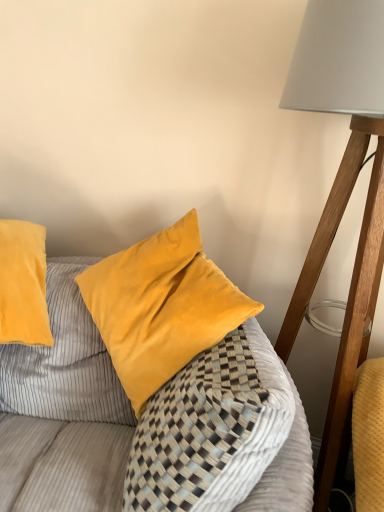
Describe the element at coordinates (135, 379) in the screenshot. I see `velvet yellow pillow at center` at that location.

In order to face velvet yellow pillow at center, should I rotate leftwards or rightwards?

You should look right and rotate roughly 1.075 degrees.

Measure the distance between point (303, 435) and camera.

Point (303, 435) is 37.20 inches away from camera.

At what (x,y) coordinates should I click in order to perform the action: click on velvet yellow pillow at center. Please return your answer as a coordinate pair (x, y). Looking at the image, I should click on [135, 379].

What is the approximate height of velvet yellow pillow at center?

velvet yellow pillow at center is 74.93 centimeters in height.

Where is `matte white lampshade at right`? This screenshot has height=512, width=384. matte white lampshade at right is located at coordinates (341, 193).

In order to face matte white lampshade at right, should I rotate leftwards or rightwards?

Rotate right and turn 19.046 degrees.

The image size is (384, 512). What do you see at coordinates (341, 193) in the screenshot?
I see `matte white lampshade at right` at bounding box center [341, 193].

Find the location of a particular element. velvet yellow pillow at center is located at coordinates (135, 379).

Between matte white lampshade at right and velvet yellow pillow at center, which one appears on the left side from the viewer's perspective?

velvet yellow pillow at center.

Is matte white lampshade at right positioned behind velvet yellow pillow at center?

Yes, matte white lampshade at right is further from the viewer.

Is point (343, 397) closer or farther from the camera than point (132, 282)?

Clearly, point (343, 397) is closer to the camera than point (132, 282).

From the image's perspective, between matte white lampshade at right and velvet yellow pillow at center, who is located below?

velvet yellow pillow at center appears lower in the image.

From a real-world perspective, is matte white lampshade at right physically located above or below velvet yellow pillow at center?

From a real-world perspective, matte white lampshade at right is physically above velvet yellow pillow at center.

Which of these two, matte white lampshade at right or velvet yellow pillow at center, is thinner?

velvet yellow pillow at center is thinner.

Between matte white lampshade at right and velvet yellow pillow at center, which one has more height?

With more height is matte white lampshade at right.

Which of these two, matte white lampshade at right or velvet yellow pillow at center, is smaller?

velvet yellow pillow at center is smaller.

Is matte white lampshade at right not inside velvet yellow pillow at center?

matte white lampshade at right lies outside velvet yellow pillow at center's area.

Is matte white lampshade at right placed right next to velvet yellow pillow at center?

There is a gap between matte white lampshade at right and velvet yellow pillow at center.

Is matte white lampshade at right positioned with its back to velvet yellow pillow at center?

No, velvet yellow pillow at center is not at the back of matte white lampshade at right.

What's the angular difference between matte white lampshade at right and velvet yellow pillow at center's facing directions?

The facing directions of matte white lampshade at right and velvet yellow pillow at center are 80.2 degrees apart.

Measure the distance from matte white lampshade at right to velvet yellow pillow at center.

matte white lampshade at right and velvet yellow pillow at center are 18.65 inches apart from each other.

Identify the location of furniture located in front of the matte white lampshade at right. This screenshot has height=512, width=384. (135, 379).

Considering the relative positions of velvet yellow pillow at center and matte white lampshade at right in the image provided, is velvet yellow pillow at center to the left of matte white lampshade at right from the viewer's perspective?

Yes.

Is velvet yellow pillow at center in front of matte white lampshade at right?

Yes, velvet yellow pillow at center is in front of matte white lampshade at right.

Is point (268, 437) in front of point (311, 13)?

Yes, point (268, 437) is closer to viewer.

From the image's perspective, relative to matte white lampshade at right, is velvet yellow pillow at center above or below?

velvet yellow pillow at center is situated lower than matte white lampshade at right in the image.

From a real-world perspective, is velvet yellow pillow at center below matte white lampshade at right?

Correct, in the physical world, velvet yellow pillow at center is lower than matte white lampshade at right.

Considering the relative sizes of velvet yellow pillow at center and matte white lampshade at right in the image provided, is velvet yellow pillow at center wider than matte white lampshade at right?

No.

Which of these two, velvet yellow pillow at center or matte white lampshade at right, stands shorter?

With less height is velvet yellow pillow at center.

Looking at the image, does velvet yellow pillow at center seem bigger or smaller compared to matte white lampshade at right?

In the image, velvet yellow pillow at center appears to be smaller than matte white lampshade at right.

Is velvet yellow pillow at center situated inside matte white lampshade at right or outside?

velvet yellow pillow at center is not enclosed by matte white lampshade at right.

Is velvet yellow pillow at center directly adjacent to matte white lampshade at right?

No, velvet yellow pillow at center is not in contact with matte white lampshade at right.

Is matte white lampshade at right at the back of velvet yellow pillow at center?

Yes.

What's the angular difference between velvet yellow pillow at center and matte white lampshade at right's facing directions?

They differ by 80.2 degrees in their facing directions.

In order to click on lamp located on the right of velvet yellow pillow at center in this screenshot , I will do pyautogui.click(x=341, y=193).

This screenshot has width=384, height=512. I want to click on lamp above the velvet yellow pillow at center (from a real-world perspective), so click(x=341, y=193).

The image size is (384, 512). In order to click on furniture lying below the matte white lampshade at right (from the image's perspective) in this screenshot , I will do `click(135, 379)`.